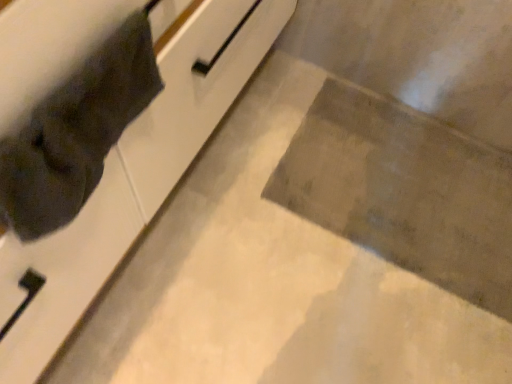
The height and width of the screenshot is (384, 512). Find the location of `dark fabric cat at left`. dark fabric cat at left is located at coordinates (76, 132).

Describe the element at coordinates (76, 132) in the screenshot. I see `dark fabric cat at left` at that location.

This screenshot has width=512, height=384. Describe the element at coordinates (134, 173) in the screenshot. I see `white glossy cabinet at upper left` at that location.

You are a GUI agent. You are given a task and a screenshot of the screen. Output one action in this format:
    pyautogui.click(x=<x>, y=<y>)
    Task: Click on the white glossy cabinet at upper left
    
    Given the screenshot: What is the action you would take?
    (134, 173)

At what (x,y) coordinates should I click in order to perform the action: click on dark fabric cat at left. Please return your answer as a coordinate pair (x, y). Looking at the image, I should click on point(76,132).

Does white glossy cabinet at upper left appear on the left side of dark fabric cat at left?

Correct, you'll find white glossy cabinet at upper left to the left of dark fabric cat at left.

Between white glossy cabinet at upper left and dark fabric cat at left, which one is positioned in front?

white glossy cabinet at upper left is in front.

Based on the photo, which is less distant, (3,101) or (81,104)?

Clearly, point (3,101) is closer to the camera than point (81,104).

In the scene shown: From the image's perspective, would you say white glossy cabinet at upper left is shown under dark fabric cat at left?

Answer: No, from the image's perspective, white glossy cabinet at upper left is not below dark fabric cat at left.

From the picture: From a real-world perspective, between white glossy cabinet at upper left and dark fabric cat at left, who is vertically lower?

white glossy cabinet at upper left.

Which of these two, white glossy cabinet at upper left or dark fabric cat at left, is thinner?

dark fabric cat at left.

Considering the relative sizes of white glossy cabinet at upper left and dark fabric cat at left in the image provided, is white glossy cabinet at upper left shorter than dark fabric cat at left?

No.

Which of these two, white glossy cabinet at upper left or dark fabric cat at left, is bigger?

With larger size is white glossy cabinet at upper left.

Is dark fabric cat at left located within white glossy cabinet at upper left?

Yes, dark fabric cat at left is inside white glossy cabinet at upper left.

From the picture: Does white glossy cabinet at upper left touch dark fabric cat at left?

They are not placed beside each other.

Is white glossy cabinet at upper left aimed at dark fabric cat at left?

Yes, white glossy cabinet at upper left faces towards dark fabric cat at left.

How different are the orientations of white glossy cabinet at upper left and dark fabric cat at left in degrees?

0.000391 degrees.

Where is `cat that is on the right side of white glossy cabinet at upper left`? This screenshot has width=512, height=384. cat that is on the right side of white glossy cabinet at upper left is located at coordinates (76, 132).

Looking at this image, which object is positioned more to the right, dark fabric cat at left or white glossy cabinet at upper left?

From the viewer's perspective, dark fabric cat at left appears more on the right side.

Which object is closer to the camera taking this photo, dark fabric cat at left or white glossy cabinet at upper left?

white glossy cabinet at upper left is more forward.

Is point (80, 183) behind point (144, 127)?

That is False.

From the image's perspective, is dark fabric cat at left below white glossy cabinet at upper left?

Indeed, from the image's perspective, dark fabric cat at left is shown beneath white glossy cabinet at upper left.

From a real-world perspective, is dark fabric cat at left over white glossy cabinet at upper left?

Yes.

Between dark fabric cat at left and white glossy cabinet at upper left, which one has larger width?

white glossy cabinet at upper left is wider.

In terms of height, does dark fabric cat at left look taller or shorter compared to white glossy cabinet at upper left?

Considering their sizes, dark fabric cat at left has less height than white glossy cabinet at upper left.

Can you confirm if dark fabric cat at left is bigger than white glossy cabinet at upper left?

Actually, dark fabric cat at left might be smaller than white glossy cabinet at upper left.

Is white glossy cabinet at upper left a part of dark fabric cat at left?

That's incorrect, white glossy cabinet at upper left is not inside dark fabric cat at left.

Is the surface of dark fabric cat at left in direct contact with white glossy cabinet at upper left?

No, dark fabric cat at left is not making contact with white glossy cabinet at upper left.

Is dark fabric cat at left aimed at white glossy cabinet at upper left?

Yes, dark fabric cat at left is facing white glossy cabinet at upper left.

How many degrees apart are the facing directions of dark fabric cat at left and white glossy cabinet at upper left?

They differ by 0.000391 degrees in their facing directions.

Identify the location of cat that appears on the right of white glossy cabinet at upper left. tap(76, 132).

The image size is (512, 384). I want to click on cat that is behind the white glossy cabinet at upper left, so 76,132.

Identify the location of cat located below the white glossy cabinet at upper left (from the image's perspective). (76, 132).